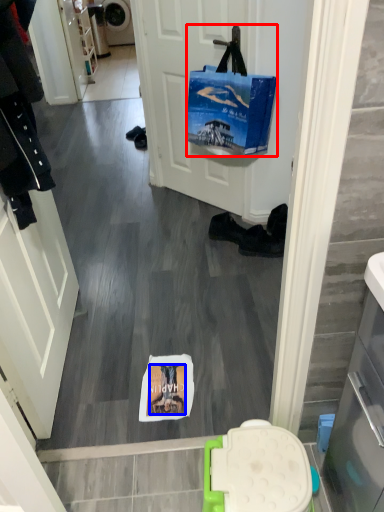
Question: Which of the following is the farthest to the observer, handbag (highlighted by a red box) or person (highlighted by a blue box)?

Choices:
 (A) handbag
 (B) person

Answer: (A)